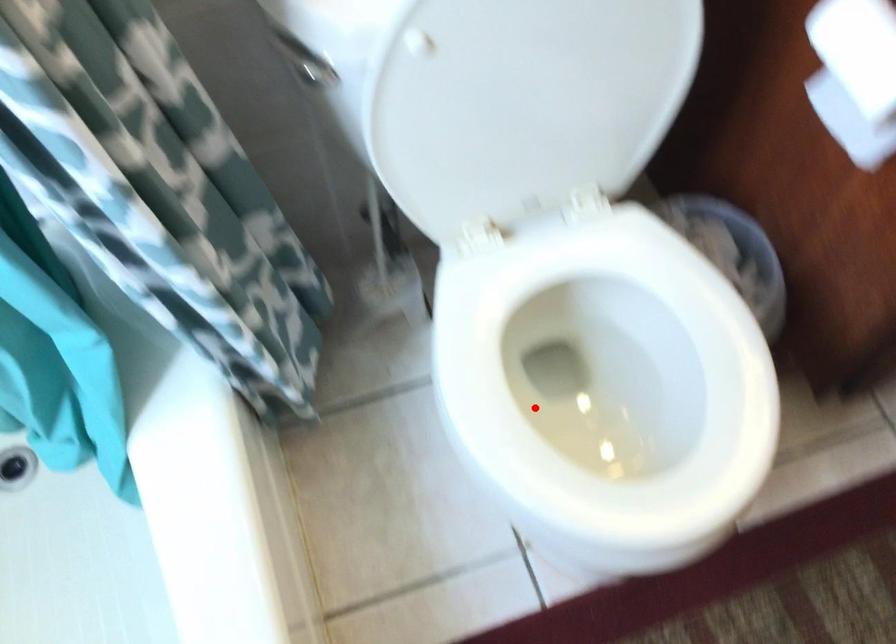
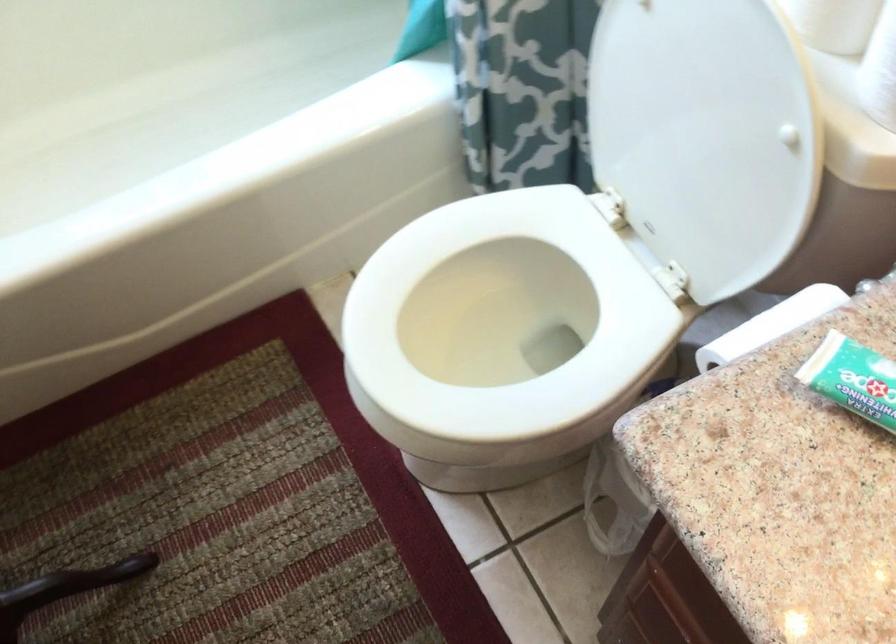
Question: A red point is marked in image1. In image2, is the corresponding 3D point closer to the camera or farther? Reply with the corresponding letter.

Choices:
 (A) The corresponding 3D point is closer.
 (B) The corresponding 3D point is farther.

Answer: (B)